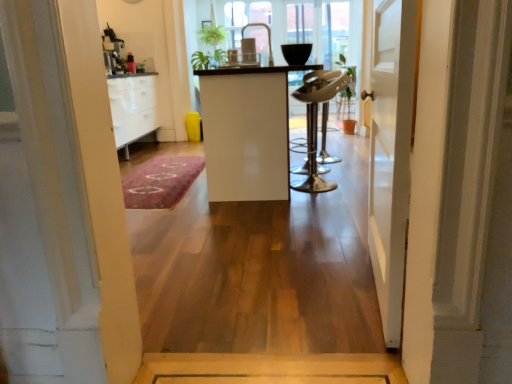
Find the location of a particular element. unoccupied area behind white wooden door at center is located at coordinates (311, 229).